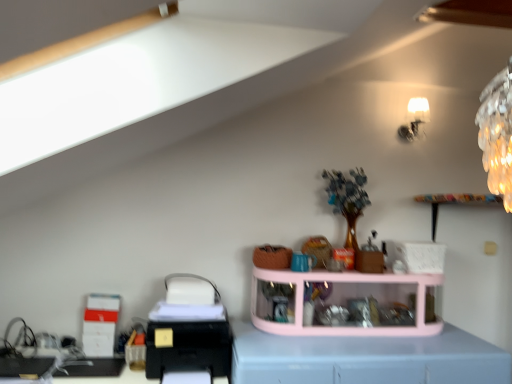
Question: Considering the relative positions of white glossy lampshade at upper right and light blue plastic at center in the image provided, is white glossy lampshade at upper right to the left of light blue plastic at center from the viewer's perspective?

Choices:
 (A) yes
 (B) no

Answer: (B)

Question: Does white glossy lampshade at upper right come behind light blue plastic at center?

Choices:
 (A) yes
 (B) no

Answer: (A)

Question: Could you tell me if white glossy lampshade at upper right is facing light blue plastic at center?

Choices:
 (A) no
 (B) yes

Answer: (A)

Question: Does white glossy lampshade at upper right have a smaller size compared to light blue plastic at center?

Choices:
 (A) yes
 (B) no

Answer: (A)

Question: Is white glossy lampshade at upper right taller than light blue plastic at center?

Choices:
 (A) no
 (B) yes

Answer: (A)

Question: In terms of height, does pink plastic shelf at center look taller or shorter compared to black plastic printer at lower left?

Choices:
 (A) tall
 (B) short

Answer: (A)

Question: Looking at their shapes, would you say pink plastic shelf at center is wider or thinner than black plastic printer at lower left?

Choices:
 (A) wide
 (B) thin

Answer: (A)

Question: Choose the correct answer: Is pink plastic shelf at center inside black plastic printer at lower left or outside it?

Choices:
 (A) outside
 (B) inside

Answer: (A)

Question: Relative to black plastic printer at lower left, is pink plastic shelf at center in front or behind?

Choices:
 (A) front
 (B) behind

Answer: (B)

Question: Which is correct: light blue plastic at center is inside white glossy lampshade at upper right, or outside of it?

Choices:
 (A) inside
 (B) outside

Answer: (B)

Question: Is light blue plastic at center in front of or behind white glossy lampshade at upper right in the image?

Choices:
 (A) behind
 (B) front

Answer: (B)

Question: In terms of height, does light blue plastic at center look taller or shorter compared to white glossy lampshade at upper right?

Choices:
 (A) short
 (B) tall

Answer: (B)

Question: Based on their sizes in the image, would you say light blue plastic at center is bigger or smaller than white glossy lampshade at upper right?

Choices:
 (A) big
 (B) small

Answer: (A)

Question: From the image's perspective, is black plastic printer at lower left positioned above or below white glossy lampshade at upper right?

Choices:
 (A) below
 (B) above

Answer: (A)

Question: Is point (224, 360) positioned closer to the camera than point (424, 107)?

Choices:
 (A) closer
 (B) farther

Answer: (A)